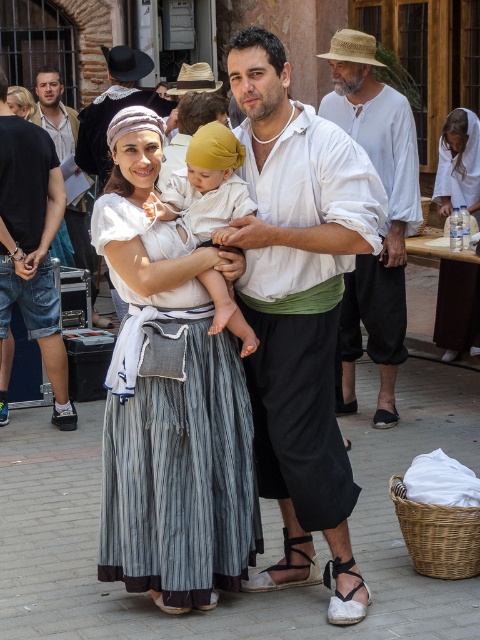
Question: Can you confirm if jeans at left is smaller than black leather sandal at lower center?

Choices:
 (A) no
 (B) yes

Answer: (A)

Question: Is the position of white cotton shirt at center less distant than that of matte white shirt at center?

Choices:
 (A) yes
 (B) no

Answer: (A)

Question: Which object is the farthest from the jeans at left?

Choices:
 (A) white fabric sandal at lower center
 (B) black leather sandal at lower center

Answer: (A)

Question: Which object appears closest to the camera in this image?

Choices:
 (A) white soft fabric baby at center
 (B) white fabric sandal at lower center
 (C) black leather sandal at lower center
 (D) straw hat at center

Answer: (B)

Question: Is jeans at left positioned at the back of white fabric sandal at lower center?

Choices:
 (A) no
 (B) yes

Answer: (B)

Question: Which object is the closest to the white soft fabric baby at center?

Choices:
 (A) straw hat at center
 (B) black leather sandal at lower center
 (C) matte white shirt at center
 (D) jeans at left

Answer: (B)